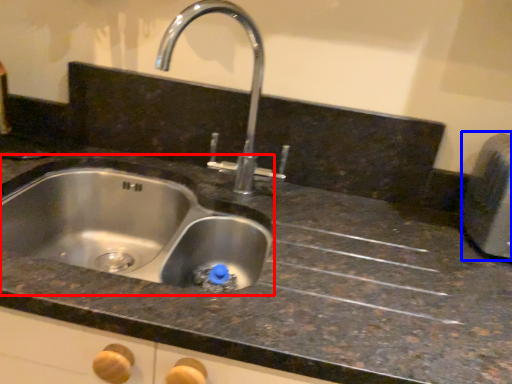
Question: Which object is closer to the camera taking this photo, sink (highlighted by a red box) or appliance (highlighted by a blue box)?

Choices:
 (A) sink
 (B) appliance

Answer: (A)